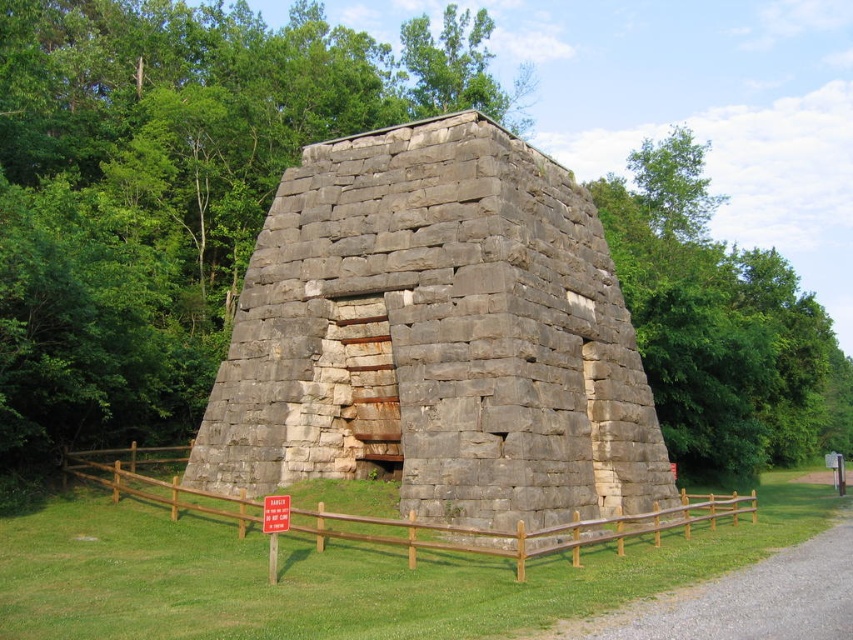
From the picture: You are a tour guide explaining the historical site to visitors. You point to the gray stone structure at center and the red plastic sign at center. Which object is taller?

The gray stone structure at center is taller than the red plastic sign at center.

You are a hiker who wants to take a photo of the red plastic sign at center. The green leafy tree at upper center is blocking your view. Can you move to the right to get a clear shot?

The green leafy tree at upper center is taller than the red plastic sign at center, so moving to the right might allow you to see around the tree to get a clear view of the red plastic sign at center.

You are a hiker who has just arrived at the gray stone structure at center and the red plastic sign at center. According to the scene description, which object is located to the left of the other?

The gray stone structure at center is positioned on the right side of red plastic sign at center, so the red plastic sign at center is to the left of the gray stone structure at center.